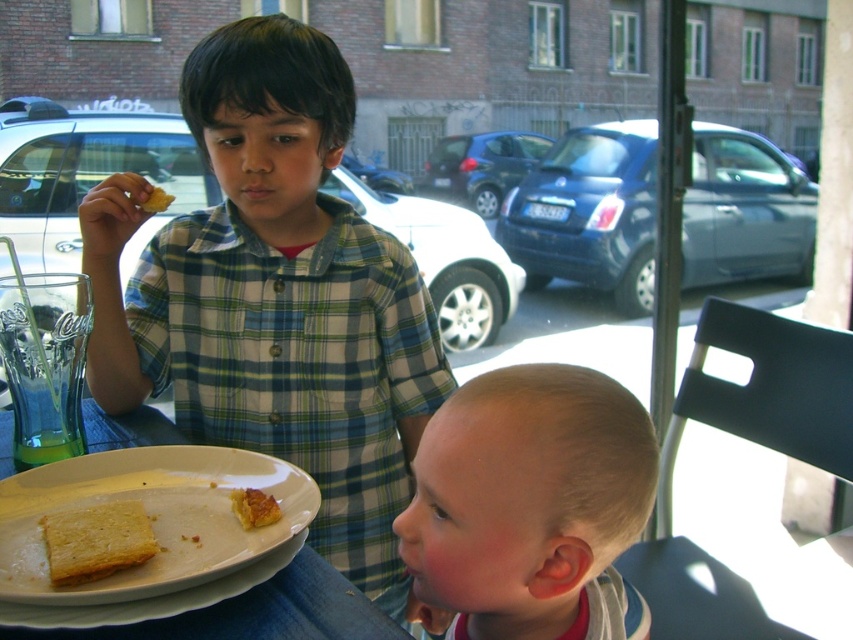
Does blonde hair at lower right come behind white ceramic plate at lower left?

No.

Is blonde hair at lower right below white ceramic plate at lower left?

Indeed, blonde hair at lower right is positioned under white ceramic plate at lower left.

Find the location of `blonde hair at lower right`. blonde hair at lower right is located at coordinates (529, 502).

Which is below, plaid shirt at center or golden crispy pastry at center?

golden crispy pastry at center is lower down.

Does plaid shirt at center appear on the right side of golden crispy pastry at center?

In fact, plaid shirt at center is to the left of golden crispy pastry at center.

Does point (305, 28) come farther from viewer compared to point (258, 500)?

That is True.

You are a GUI agent. You are given a task and a screenshot of the screen. Output one action in this format:
    pyautogui.click(x=<x>, y=<y>)
    Task: Click on the plaid shirt at center
    
    Given the screenshot: What is the action you would take?
    pyautogui.click(x=276, y=300)

Is golden crispy pastry at center smaller than yellow crumbly bread at upper left?

Correct, golden crispy pastry at center occupies less space than yellow crumbly bread at upper left.

Is point (233, 492) positioned behind point (155, 189)?

No, (233, 492) is closer to viewer.

The image size is (853, 640). I want to click on golden crispy pastry at center, so click(x=253, y=508).